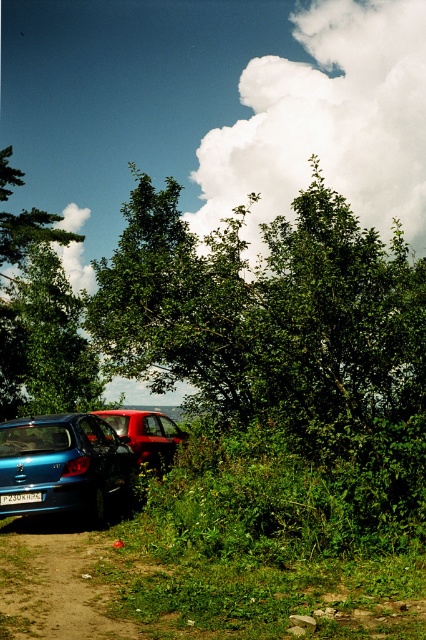
Looking at this image, you are a delivery person trying to navigate through the narrow path between the blue car on the left and the red vehicle on the right. There is a green leafy tree at center in your way. Based on the coordinates provided, can you determine if the tree is blocking your path?

The green leafy tree at center is positioned at coordinates point (265, 316). Since the path is between the blue car on the left and the red vehicle on the right, the tree is centrally located and likely blocking the path.

You are a hiker trying to find a path to continue your journey. You see a brown dirt track at lower left and a metallic blue sedan at lower left. Which one takes up more space in the image?

The metallic blue sedan at lower left takes up more space in the image than the brown dirt track at lower left because the brown dirt track at lower left occupies less space than metallic blue sedan at lower left.

You are a delivery person trying to navigate through the narrow path where the metallic blue sedan at lower left and the white plastic license plate at lower center are located. Based on their sizes, which object would you need to avoid hitting more carefully to prevent damage?

The metallic blue sedan at lower left has a larger size compared to the white plastic license plate at lower center, so you should prioritize avoiding the metallic blue sedan at lower left to prevent damage since it is bigger and more substantial.